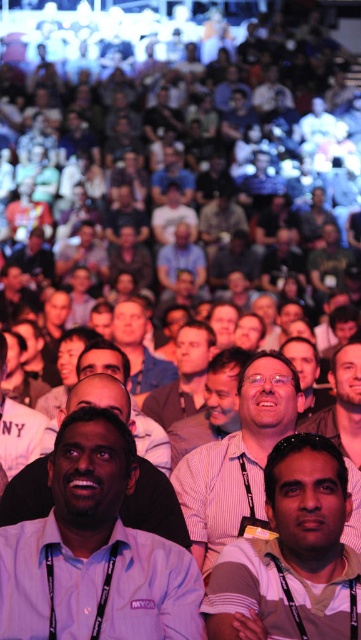
You are sitting in the front row of the conference hall and notice two attendees wearing striped shirts. The first is wearing a striped cotton shirt at center, and the second is wearing a light brown striped shirt at center. Which attendee is sitting closer to the stage?

The striped cotton shirt at center is located below the light brown striped shirt at center, meaning the attendee wearing the striped cotton shirt at center is sitting closer to the stage since they are positioned lower in the image.

You are standing at the back of the conference hall and want to take a photo of two points in the scene. The first point is labeled as point (354, 618) and the second is point (185, 413). Which point will appear larger in your photo?

Point (354, 618) will appear larger in the photo because it is closer to the camera than point (185, 413).

Looking at this image, you are standing in the conference hall and want to take a photo of the point at coordinates point [185,483]. If your camera has a focal length of 50mm and you are 31.04 meters away from the point, what is the approximate angle of view needed to capture the point in the center of the photo?

The point [185,483] is 31.04 meters away from the camera. To calculate the angle of view needed, use the formula angle of view in radians equals arctangent of object distance divided by focal length. However, since the exact dimensions of the object aren not provided, it is not possible to determine the exact angle of view required. The question might need more information about the size of the point or the desired framing.